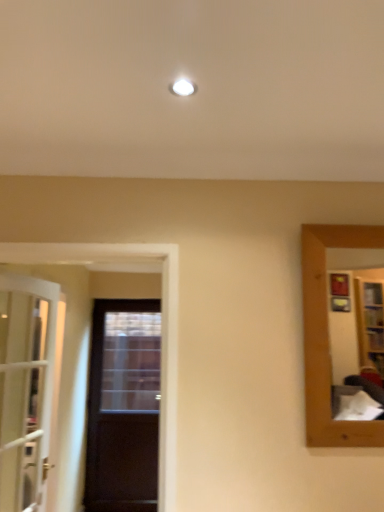
What do you see at coordinates (25, 388) in the screenshot? This screenshot has height=512, width=384. I see `white glass door at left, which is the 1th door from left to right` at bounding box center [25, 388].

Image resolution: width=384 pixels, height=512 pixels. Identify the location of white glass door at left, which is the second door from back to front. (25, 388).

This screenshot has height=512, width=384. What do you see at coordinates (123, 407) in the screenshot?
I see `dark wood door at center, which appears as the second door when viewed from the front` at bounding box center [123, 407].

Where is `dark wood door at center, the 1th door when ordered from back to front`? The image size is (384, 512). dark wood door at center, the 1th door when ordered from back to front is located at coordinates (123, 407).

Measure the distance between dark wood door at center, which is the 2th door from left to right, and camera.

dark wood door at center, which is the 2th door from left to right, is 3.93 meters away from camera.

Where is `white glass door at left, which is the second door from back to front`? white glass door at left, which is the second door from back to front is located at coordinates (25, 388).

Visually, is dark wood door at center, which appears as the first door when viewed from the right, positioned to the left or to the right of white glass door at left, which is the 1th door from left to right?

From the image, it's evident that dark wood door at center, which appears as the first door when viewed from the right, is to the right of white glass door at left, which is the 1th door from left to right.

Considering their positions, is dark wood door at center, which appears as the second door when viewed from the front, located in front of or behind white glass door at left, the first door when ordered from front to back?

dark wood door at center, which appears as the second door when viewed from the front, is behind white glass door at left, the first door when ordered from front to back.

Which is behind, point (103, 384) or point (21, 310)?

The point (103, 384) is farther from the camera.

From the image's perspective, between dark wood door at center, which appears as the second door when viewed from the front, and white glass door at left, which ranks as the 2th door in right-to-left order, which one is located above?

white glass door at left, which ranks as the 2th door in right-to-left order.

From a real-world perspective, which object rests below the other?

dark wood door at center, which appears as the second door when viewed from the front, from a real-world perspective.

Looking at their sizes, would you say dark wood door at center, which is the 2th door from left to right, is wider or thinner than white glass door at left, which ranks as the 2th door in right-to-left order?

In the image, dark wood door at center, which is the 2th door from left to right, appears to be more narrow than white glass door at left, which ranks as the 2th door in right-to-left order.

Considering the sizes of objects dark wood door at center, the 1th door when ordered from back to front, and white glass door at left, which is the second door from back to front, in the image provided, who is shorter, dark wood door at center, the 1th door when ordered from back to front, or white glass door at left, which is the second door from back to front,?

With less height is white glass door at left, which is the second door from back to front.

Considering the sizes of objects dark wood door at center, which appears as the first door when viewed from the right, and white glass door at left, which is the second door from back to front, in the image provided, who is smaller, dark wood door at center, which appears as the first door when viewed from the right, or white glass door at left, which is the second door from back to front,?

With smaller size is dark wood door at center, which appears as the first door when viewed from the right.

Is dark wood door at center, which appears as the second door when viewed from the front, inside or outside of white glass door at left, the first door when ordered from front to back?

dark wood door at center, which appears as the second door when viewed from the front, is outside white glass door at left, the first door when ordered from front to back.

Can you see dark wood door at center, which appears as the second door when viewed from the front, touching white glass door at left, which is the second door from back to front?

No, dark wood door at center, which appears as the second door when viewed from the front, is not with white glass door at left, which is the second door from back to front.

Is dark wood door at center, which is the 2th door from left to right, facing away from white glass door at left, which is the 1th door from left to right?

That's not correct — dark wood door at center, which is the 2th door from left to right, is not looking away from white glass door at left, which is the 1th door from left to right.

How many degrees apart are the facing directions of dark wood door at center, which is the 2th door from left to right, and white glass door at left, which is the second door from back to front?

The facing directions of dark wood door at center, which is the 2th door from left to right, and white glass door at left, which is the second door from back to front, are 90.8 degrees apart.

In the image, there is a white glass door at left, which is the 1th door from left to right. Identify the location of door below it (from a real-world perspective). point(123,407).

Considering the relative positions of white glass door at left, the first door when ordered from front to back, and dark wood door at center, the 1th door when ordered from back to front, in the image provided, is white glass door at left, the first door when ordered from front to back, to the right of dark wood door at center, the 1th door when ordered from back to front, from the viewer's perspective?

Incorrect, white glass door at left, the first door when ordered from front to back, is not on the right side of dark wood door at center, the 1th door when ordered from back to front.

Which object is closer to the camera, white glass door at left, which ranks as the 2th door in right-to-left order, or dark wood door at center, which appears as the first door when viewed from the right?

white glass door at left, which ranks as the 2th door in right-to-left order, is in front.

Considering the points (26, 473) and (119, 413), which point is behind, point (26, 473) or point (119, 413)?

The point (119, 413) is more distant.

From the image's perspective, is white glass door at left, the first door when ordered from front to back, located beneath dark wood door at center, the 1th door when ordered from back to front?

No, from the image's perspective, white glass door at left, the first door when ordered from front to back, is not below dark wood door at center, the 1th door when ordered from back to front.

From a real-world perspective, is white glass door at left, which is the 1th door from left to right, physically located above or below dark wood door at center, which is the 2th door from left to right?

white glass door at left, which is the 1th door from left to right, is above dark wood door at center, which is the 2th door from left to right.

Considering the relative sizes of white glass door at left, which ranks as the 2th door in right-to-left order, and dark wood door at center, which appears as the second door when viewed from the front, in the image provided, is white glass door at left, which ranks as the 2th door in right-to-left order, wider than dark wood door at center, which appears as the second door when viewed from the front,?

Indeed, white glass door at left, which ranks as the 2th door in right-to-left order, has a greater width compared to dark wood door at center, which appears as the second door when viewed from the front.

Considering the sizes of white glass door at left, the first door when ordered from front to back, and dark wood door at center, the 1th door when ordered from back to front, in the image, is white glass door at left, the first door when ordered from front to back, taller or shorter than dark wood door at center, the 1th door when ordered from back to front,?

Considering their sizes, white glass door at left, the first door when ordered from front to back, has less height than dark wood door at center, the 1th door when ordered from back to front.

Who is bigger, white glass door at left, the first door when ordered from front to back, or dark wood door at center, which appears as the second door when viewed from the front?

Bigger between the two is white glass door at left, the first door when ordered from front to back.

Would you say white glass door at left, the first door when ordered from front to back, is outside dark wood door at center, which appears as the second door when viewed from the front?

Yes, white glass door at left, the first door when ordered from front to back, is located beyond the bounds of dark wood door at center, which appears as the second door when viewed from the front.

Is white glass door at left, which is the second door from back to front, far from dark wood door at center, the 1th door when ordered from back to front?

That's right, there is a large distance between white glass door at left, which is the second door from back to front, and dark wood door at center, the 1th door when ordered from back to front.

In the scene shown: Is dark wood door at center, which appears as the second door when viewed from the front, at the back of white glass door at left, which is the 1th door from left to right?

That's not correct — white glass door at left, which is the 1th door from left to right, is not looking away from dark wood door at center, which appears as the second door when viewed from the front.

Can you tell me how much white glass door at left, the first door when ordered from front to back, and dark wood door at center, which is the 2th door from left to right, differ in facing direction?

They differ by 90.8 degrees in their facing directions.

At what (x,y) coordinates should I click in order to perform the action: click on door lying below the white glass door at left, which ranks as the 2th door in right-to-left order (from the image's perspective). Please return your answer as a coordinate pair (x, y). This screenshot has height=512, width=384. Looking at the image, I should click on (123, 407).

Find the location of `door lying behind the white glass door at left, which ranks as the 2th door in right-to-left order`. door lying behind the white glass door at left, which ranks as the 2th door in right-to-left order is located at coordinates (123, 407).

Locate an element on the screen. This screenshot has width=384, height=512. door that is above the dark wood door at center, which appears as the first door when viewed from the right (from the image's perspective) is located at coordinates (25, 388).